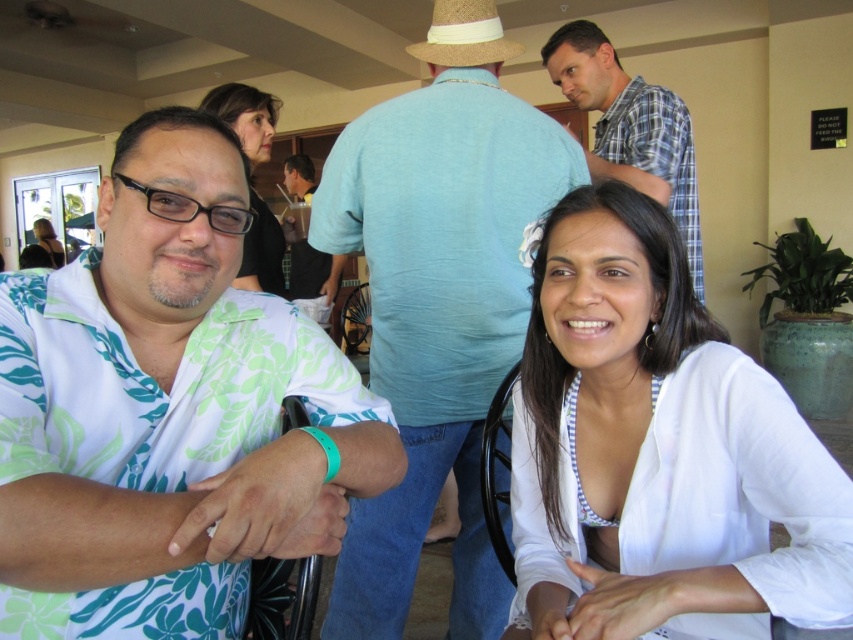
Question: Estimate the real-world distances between objects in this image. Which object is farther from the white floral shirt at left?

Choices:
 (A) matte black hair at upper left
 (B) white textured blouse at center
 (C) light blue cotton shirt at center

Answer: (A)

Question: Does white floral shirt at left have a lesser width compared to matte black hair at upper left?

Choices:
 (A) yes
 (B) no

Answer: (A)

Question: Is white textured blouse at center positioned before matte black hair at upper center?

Choices:
 (A) yes
 (B) no

Answer: (A)

Question: Which object appears farthest from the camera in this image?

Choices:
 (A) matte black hair at upper left
 (B) white textured blouse at center

Answer: (A)

Question: Does light blue cotton shirt at center have a greater width compared to matte black hair at upper left?

Choices:
 (A) no
 (B) yes

Answer: (A)

Question: Among these points, which one is farthest from the camera?

Choices:
 (A) (245, 99)
 (B) (422, 285)
 (C) (761, 451)
 (D) (122, 362)

Answer: (A)